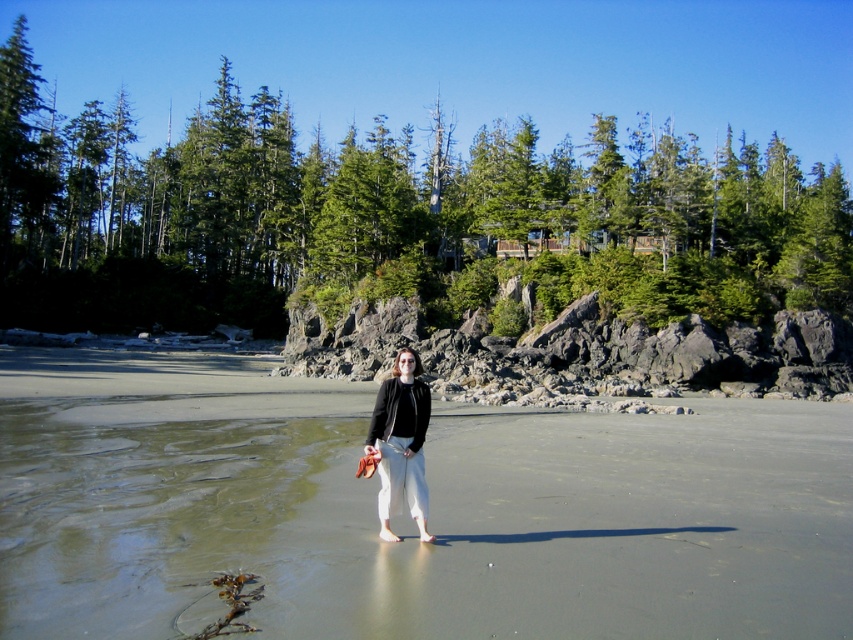
You are a photographer planning to take a landscape shot of the smooth sand beach at center and the green matte pine at upper center. Which object will appear smaller in the photo?

The smooth sand beach at center will appear smaller in the photo because it is not as tall as the green matte pine at upper center.

You are planning to set up a picnic area on the smooth sand beach at center. Considering the space available, will the matte black jacket at center fit comfortably on the beach without overlapping the edges?

The smooth sand beach at center has a larger width than the matte black jacket at center, so the jacket can fit comfortably without overlapping the edges.

You are standing at the edge of the smooth sand beach at center. If you walk straight ahead, will you eventually reach the rocky shoreline with scattered boulders and patches of green vegetation?

Yes, walking straight ahead from the smooth sand beach at center will lead you to the rocky shoreline with scattered boulders and patches of green vegetation described in the scene.